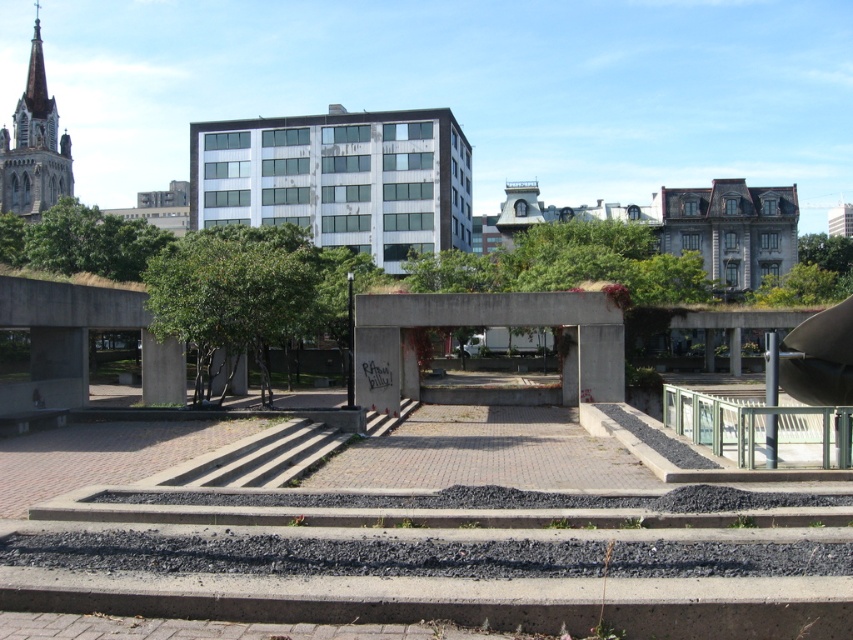
Is point (126, 225) positioned before point (798, 243)?

That is True.

Is point (137, 259) behind point (810, 241)?

No, it is not.

Who is more distant from viewer, (x=100, y=248) or (x=817, y=250)?

The point (x=817, y=250) is more distant.

You are a GUI agent. You are given a task and a screenshot of the screen. Output one action in this format:
    pyautogui.click(x=<x>, y=<y>)
    Task: Click on the green leafy tree at upper left
    This screenshot has width=853, height=640.
    Given the screenshot: What is the action you would take?
    pyautogui.click(x=80, y=241)

Does green leafy tree at center have a greater height compared to green leafy tree at upper left?

Indeed, green leafy tree at center has a greater height compared to green leafy tree at upper left.

Find the location of a particular element. green leafy tree at center is located at coordinates (231, 294).

This screenshot has height=640, width=853. In order to click on green leafy tree at center in this screenshot , I will do `click(231, 294)`.

What do you see at coordinates (231, 294) in the screenshot? The width and height of the screenshot is (853, 640). I see `green leafy tree at center` at bounding box center [231, 294].

Is green leafy tree at center thinner than green leafy tree at upper right?

In fact, green leafy tree at center might be wider than green leafy tree at upper right.

The height and width of the screenshot is (640, 853). I want to click on green leafy tree at center, so click(231, 294).